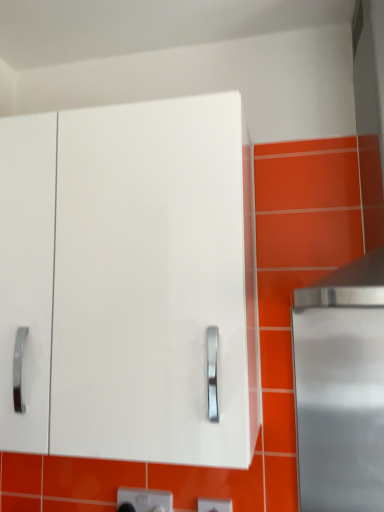
What do you see at coordinates (214, 505) in the screenshot? The image size is (384, 512). I see `white plastic electric outlet at lower center, which is counted as the first electric outlet, starting from the front` at bounding box center [214, 505].

Find the location of a particular element. white plastic electric outlet at lower center, positioned as the second electric outlet in front-to-back order is located at coordinates [144, 500].

You are a GUI agent. You are given a task and a screenshot of the screen. Output one action in this format:
    pyautogui.click(x=<x>, y=<y>)
    Task: Click on the 2nd electric outlet counting from the right of the white glossy cabinet at center
    Image resolution: width=384 pixels, height=512 pixels.
    Given the screenshot: What is the action you would take?
    point(214,505)

Is white plastic electric outlet at lower center, the 2th electric outlet from the back, far from white glossy cabinet at center?

Actually, white plastic electric outlet at lower center, the 2th electric outlet from the back, and white glossy cabinet at center are a little close together.

From the image's perspective, which is below, white plastic electric outlet at lower center, which is counted as the 1th electric outlet, starting from the left, or white glossy cabinet at center?

From the image's view, white plastic electric outlet at lower center, which is counted as the 1th electric outlet, starting from the left, is below.

Consider the image. Is white plastic electric outlet at lower center, which appears as the 1th electric outlet when viewed from the back, outside of white glossy cabinet at center?

Absolutely, white plastic electric outlet at lower center, which appears as the 1th electric outlet when viewed from the back, is external to white glossy cabinet at center.

Between point (128, 506) and point (197, 176), which one is positioned in front?

The point (197, 176) is closer to the camera.

Which object is positioned more to the left, white plastic electric outlet at lower center, which appears as the 1th electric outlet when viewed from the back, or white glossy cabinet at center?

white glossy cabinet at center.

Consider the image. Which object is further away from the camera taking this photo, white glossy cabinet at center or white plastic electric outlet at lower center, the 2th electric outlet from the back?

white plastic electric outlet at lower center, the 2th electric outlet from the back, is further away from the camera.

Considering the sizes of objects white glossy cabinet at center and white plastic electric outlet at lower center, which is counted as the first electric outlet, starting from the front, in the image provided, who is smaller, white glossy cabinet at center or white plastic electric outlet at lower center, which is counted as the first electric outlet, starting from the front,?

white plastic electric outlet at lower center, which is counted as the first electric outlet, starting from the front.

Between white glossy cabinet at center and white plastic electric outlet at lower center, which is counted as the first electric outlet, starting from the right, which one has larger width?

Wider between the two is white glossy cabinet at center.

From the image's perspective, which is below, white glossy cabinet at center or white plastic electric outlet at lower center, which is counted as the first electric outlet, starting from the right?

white plastic electric outlet at lower center, which is counted as the first electric outlet, starting from the right, from the image's perspective.

Can you confirm if white plastic electric outlet at lower center, which is counted as the 1th electric outlet, starting from the left, is bigger than white plastic electric outlet at lower center, which is the second electric outlet in left-to-right order?

Yes.

In the image, is white plastic electric outlet at lower center, positioned as the second electric outlet in front-to-back order, positioned in front of or behind white plastic electric outlet at lower center, which is the second electric outlet in left-to-right order?

white plastic electric outlet at lower center, positioned as the second electric outlet in front-to-back order, is positioned farther from the viewer than white plastic electric outlet at lower center, which is the second electric outlet in left-to-right order.

In order to click on electric outlet that appears below the white plastic electric outlet at lower center, which appears as the 1th electric outlet when viewed from the back (from a real-world perspective) in this screenshot , I will do `click(214, 505)`.

How far apart are white glossy cabinet at center and white plastic electric outlet at lower center, which appears as the 1th electric outlet when viewed from the back?

white glossy cabinet at center is 25.15 inches away from white plastic electric outlet at lower center, which appears as the 1th electric outlet when viewed from the back.

Considering the sizes of objects white glossy cabinet at center and white plastic electric outlet at lower center, which appears as the 1th electric outlet when viewed from the back, in the image provided, who is taller, white glossy cabinet at center or white plastic electric outlet at lower center, which appears as the 1th electric outlet when viewed from the back,?

white glossy cabinet at center is taller.

Which is behind, white glossy cabinet at center or white plastic electric outlet at lower center, which is counted as the 1th electric outlet, starting from the left?

white plastic electric outlet at lower center, which is counted as the 1th electric outlet, starting from the left, is more distant.

From the picture: Based on their sizes in the image, would you say white glossy cabinet at center is bigger or smaller than white plastic electric outlet at lower center, which appears as the 1th electric outlet when viewed from the back?

white glossy cabinet at center is bigger than white plastic electric outlet at lower center, which appears as the 1th electric outlet when viewed from the back.

Which of these two, white plastic electric outlet at lower center, which is counted as the first electric outlet, starting from the right, or white plastic electric outlet at lower center, positioned as the second electric outlet in front-to-back order, stands shorter?

white plastic electric outlet at lower center, which is counted as the first electric outlet, starting from the right, is shorter.

From a real-world perspective, is white plastic electric outlet at lower center, which is the second electric outlet in left-to-right order, positioned over white plastic electric outlet at lower center, which is counted as the 1th electric outlet, starting from the left, based on gravity?

Incorrect, from a real-world perspective, white plastic electric outlet at lower center, which is the second electric outlet in left-to-right order, is lower than white plastic electric outlet at lower center, which is counted as the 1th electric outlet, starting from the left.

Which object is closer to the camera, white plastic electric outlet at lower center, which is counted as the first electric outlet, starting from the right, or white plastic electric outlet at lower center, positioned as the second electric outlet in front-to-back order?

Positioned in front is white plastic electric outlet at lower center, which is counted as the first electric outlet, starting from the right.

From the image's perspective, between white plastic electric outlet at lower center, the 2th electric outlet from the back, and white plastic electric outlet at lower center, which appears as the 1th electric outlet when viewed from the back, who is located below?

white plastic electric outlet at lower center, which appears as the 1th electric outlet when viewed from the back, is shown below in the image.

Identify the location of electric outlet that is the 2nd one when counting rightward from the white glossy cabinet at center. This screenshot has width=384, height=512. (214, 505).

This screenshot has width=384, height=512. Identify the location of the 2nd electric outlet positioned below the white glossy cabinet at center (from the image's perspective). (144, 500).

Looking at the image, which one is located closer to white plastic electric outlet at lower center, positioned as the second electric outlet in front-to-back order, white plastic electric outlet at lower center, which is the second electric outlet in left-to-right order, or white glossy cabinet at center?

white plastic electric outlet at lower center, which is the second electric outlet in left-to-right order, is positioned closer to the anchor white plastic electric outlet at lower center, positioned as the second electric outlet in front-to-back order.

Based on their spatial positions, is white glossy cabinet at center or white plastic electric outlet at lower center, which is counted as the 1th electric outlet, starting from the left, further from white plastic electric outlet at lower center, which is counted as the first electric outlet, starting from the front?

white glossy cabinet at center.

Which object lies further to the anchor point white plastic electric outlet at lower center, which is counted as the 1th electric outlet, starting from the left, white glossy cabinet at center or white plastic electric outlet at lower center, which is counted as the first electric outlet, starting from the right?

Among the two, white glossy cabinet at center is located further to white plastic electric outlet at lower center, which is counted as the 1th electric outlet, starting from the left.

Considering their positions, is white plastic electric outlet at lower center, which is the second electric outlet in left-to-right order, positioned further to white glossy cabinet at center than white plastic electric outlet at lower center, positioned as the second electric outlet in front-to-back order?

white plastic electric outlet at lower center, which is the second electric outlet in left-to-right order, lies further to white glossy cabinet at center than the other object.

Looking at the image, which one is located further to white glossy cabinet at center, white plastic electric outlet at lower center, positioned as the 2th electric outlet in right-to-left order, or white plastic electric outlet at lower center, the 2th electric outlet from the back?

white plastic electric outlet at lower center, the 2th electric outlet from the back, lies further to white glossy cabinet at center than the other object.

When comparing their distances from white plastic electric outlet at lower center, the 2th electric outlet from the back, does white plastic electric outlet at lower center, positioned as the 2th electric outlet in right-to-left order, or white glossy cabinet at center seem further?

white glossy cabinet at center is further to white plastic electric outlet at lower center, the 2th electric outlet from the back.

Locate an element on the screen. electric outlet between white glossy cabinet at center and white plastic electric outlet at lower center, which is counted as the 1th electric outlet, starting from the left, in the up-down direction is located at coordinates (214, 505).